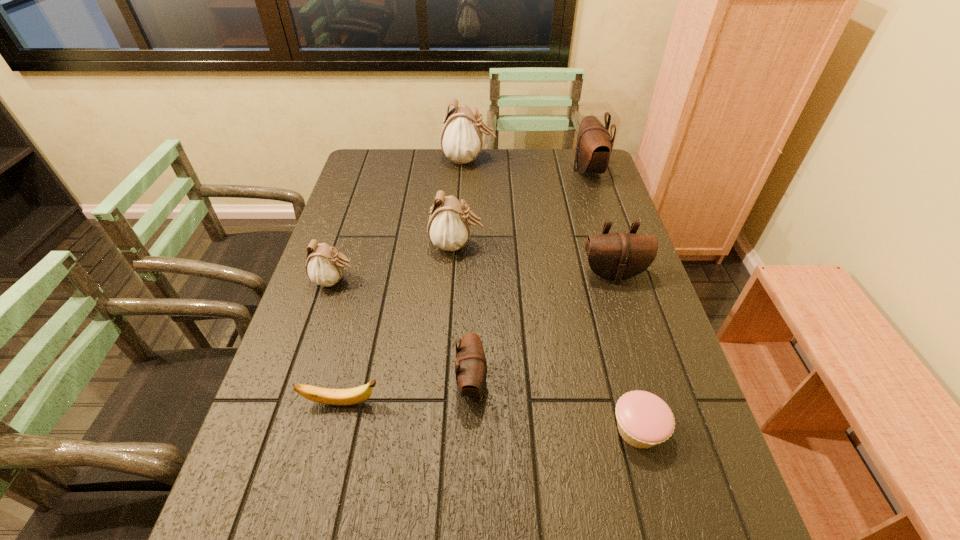
At what (x,y) coordinates should I click in order to perform the action: click on free spot located 0.060m with the flap open on the nearest brown pouch. Please return your answer as a coordinate pair (x, y). Image resolution: width=960 pixels, height=540 pixels. Looking at the image, I should click on (515, 383).

This screenshot has height=540, width=960. Find the location of `vacant space located 0.380m at the stem of the yellow banana`. vacant space located 0.380m at the stem of the yellow banana is located at coordinates (557, 403).

What are the coordinates of `vacant space located 0.050m on the left of the shortest object` in the screenshot? It's located at click(x=587, y=429).

The height and width of the screenshot is (540, 960). What are the coordinates of `pouch that is at the left edge` in the screenshot? It's located at [x=324, y=266].

Locate an element on the screen. Image resolution: width=960 pixels, height=540 pixels. banana that is at the left edge is located at coordinates (351, 396).

Find the location of a particular element. cupcake at the right edge is located at coordinates (644, 420).

Locate an element on the screen. This screenshot has height=540, width=960. object that is at the far right corner is located at coordinates (594, 145).

In the image, there is a desktop. At what (x,y) coordinates should I click in order to perform the action: click on vacant space at the far edge. Please return your answer as a coordinate pair (x, y). Looking at the image, I should click on (445, 166).

Where is `vacant region at the left edge of the desktop`? vacant region at the left edge of the desktop is located at coordinates tap(325, 364).

The image size is (960, 540). In the image, there is a desktop. In order to click on vacant space at the right edge in this screenshot , I will do `click(624, 215)`.